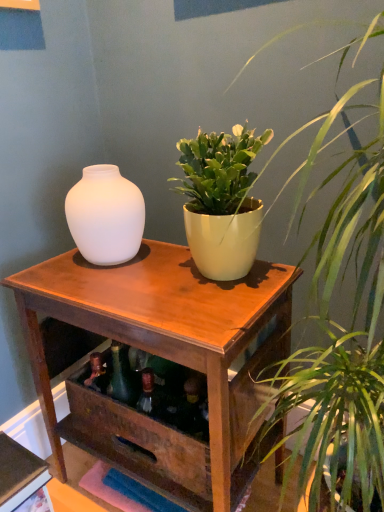
This screenshot has height=512, width=384. What are the coordinates of `vacant area that lies between green matte plant pot at center, marked as the 1th houseplant in a top-to-bottom arrangement, and matte white vase at left` in the screenshot? It's located at (156, 266).